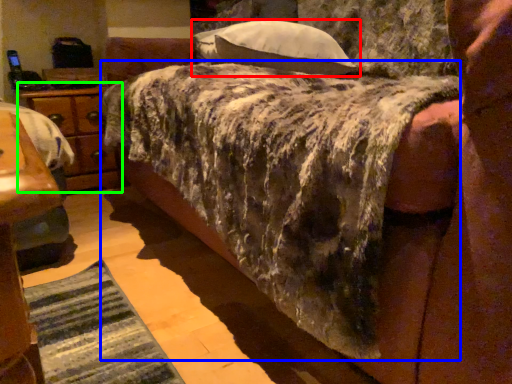
Question: Which is farther away from pillow (highlighted by a red box)? mattress (highlighted by a blue box) or nightstand (highlighted by a green box)?

Choices:
 (A) mattress
 (B) nightstand

Answer: (B)